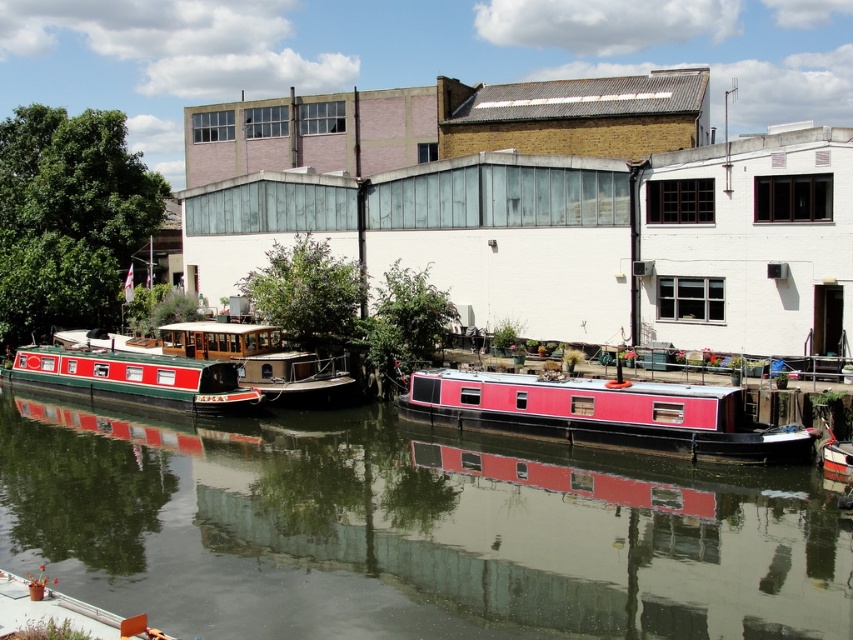
You are a delivery person needing to move a package from the red glossy barge at left to the closest building. The distance between them is 122.39 feet. If your vehicle can carry packages up to 150 feet, can you safely make the trip without needing to recharge?

The distance between the red glossy barge at left and the closest building is 122.39 feet, which is within the vehicle capacity of 150 feet. Therefore, you can safely make the trip without needing to recharge.

You are a delivery person needing to cross the canal to reach a warehouse located near the industrial building in the background. You have a small boat that is 2 meters long. The path you need to take goes between the smooth water at center and the red polished wood barge at center. Is your boat able to pass through this path?

The smooth water at center and red polished wood barge at center are 9.12 meters apart from each other. Since your boat is only 2 meters long, it can easily pass through the 9.12 meter gap between the smooth water at center and the red polished wood barge at center.